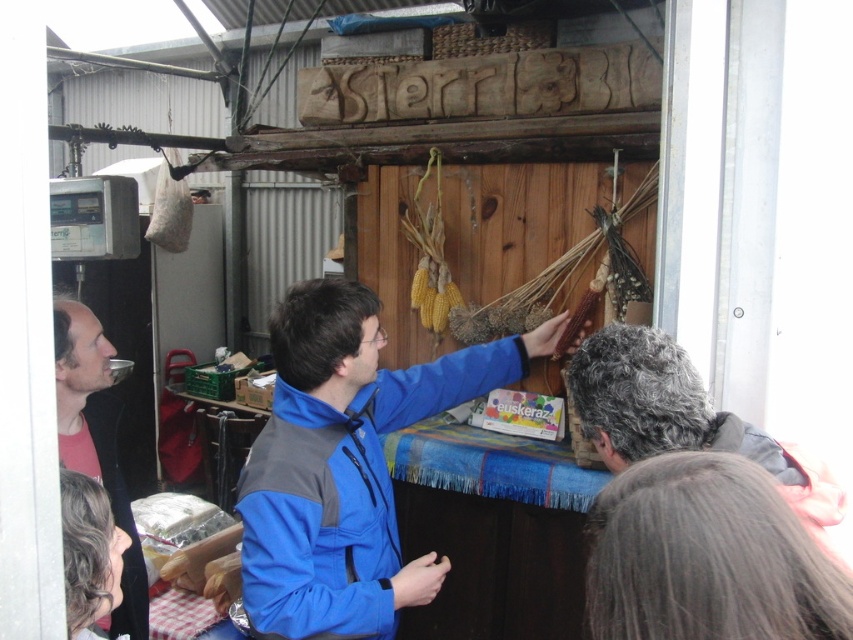
You are a delivery person who needs to place a package between the gray hair at upper center and the matte black jacket at left. The package is 1.2 meters long. Can you fit it between them without moving either object?

The distance between the gray hair at upper center and the matte black jacket at left is 1.15 meters, which is shorter than the package length of 1.2 meters. Therefore, the package cannot be placed between them without moving either object.

You are a customer at the market and want to approach the stall. Which jacket, the blue fleece jacket at center or the matte black jacket at left, is closer to the stall?

The blue fleece jacket at center is closer to the stall because it is closer to the viewer than the matte black jacket at left.

You are a photographer trying to capture the market scene. You notice the blue fleece jacket at center and the gray hair at upper center. Which object would you need to adjust your camera focus more for if you want to highlight the larger object?

The blue fleece jacket at center is larger in width than the gray hair at upper center, so you should focus on the blue fleece jacket at center to highlight the larger object.